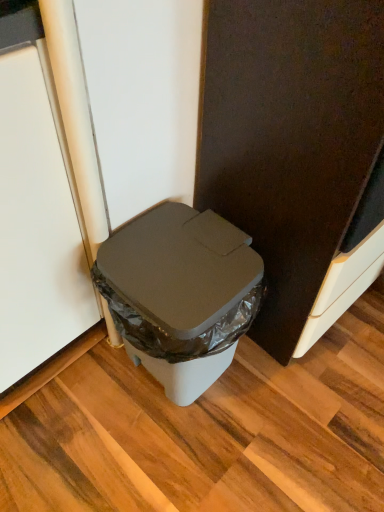
Measure the distance between matte plastic trash can at center and camera.

The distance of matte plastic trash can at center from camera is 30.03 inches.

Describe the element at coordinates (181, 294) in the screenshot. I see `matte plastic trash can at center` at that location.

In order to face matte plastic trash can at center, should I rotate leftwards or rightwards?

You should look left and rotate roughly 1.382 degrees.

Where is `matte plastic trash can at center`? The height and width of the screenshot is (512, 384). matte plastic trash can at center is located at coordinates (181, 294).

You are a GUI agent. You are given a task and a screenshot of the screen. Output one action in this format:
    pyautogui.click(x=<x>, y=<y>)
    Task: Click on the matte plastic trash can at center
    The height and width of the screenshot is (512, 384).
    Given the screenshot: What is the action you would take?
    pyautogui.click(x=181, y=294)